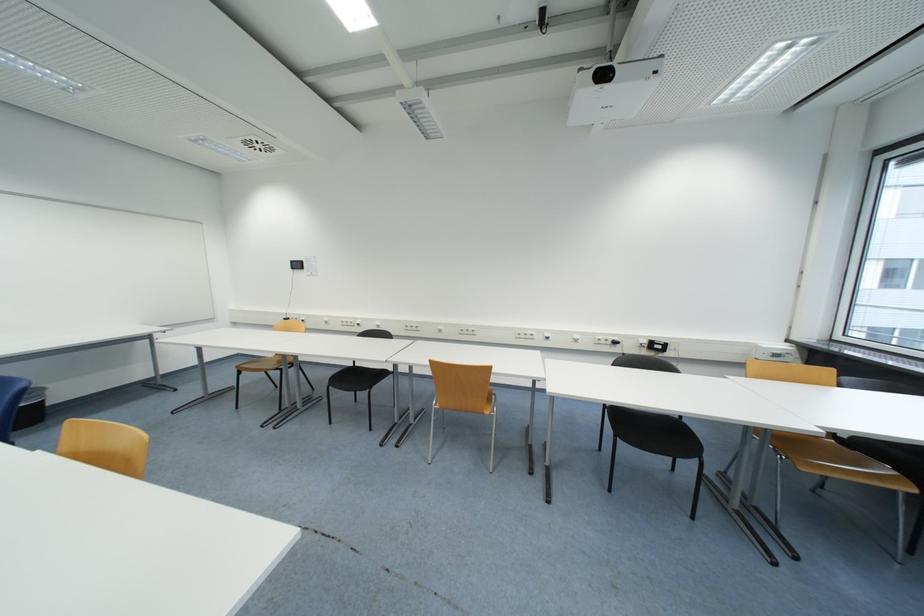
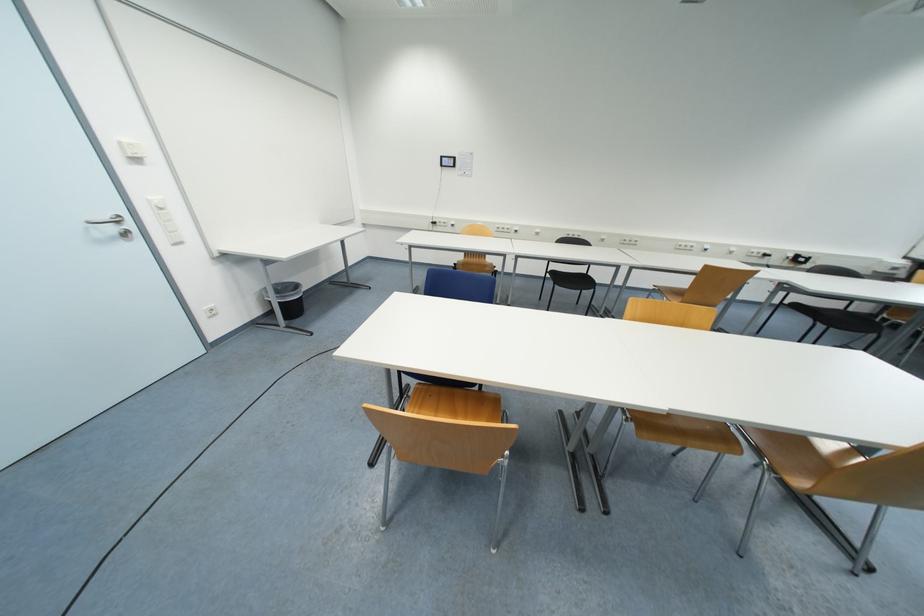
Question: The images are taken continuously from a first-person perspective. In which direction are you moving?

Choices:
 (A) Left
 (B) Right
 (C) Forward
 (D) Backward

Answer: (A)